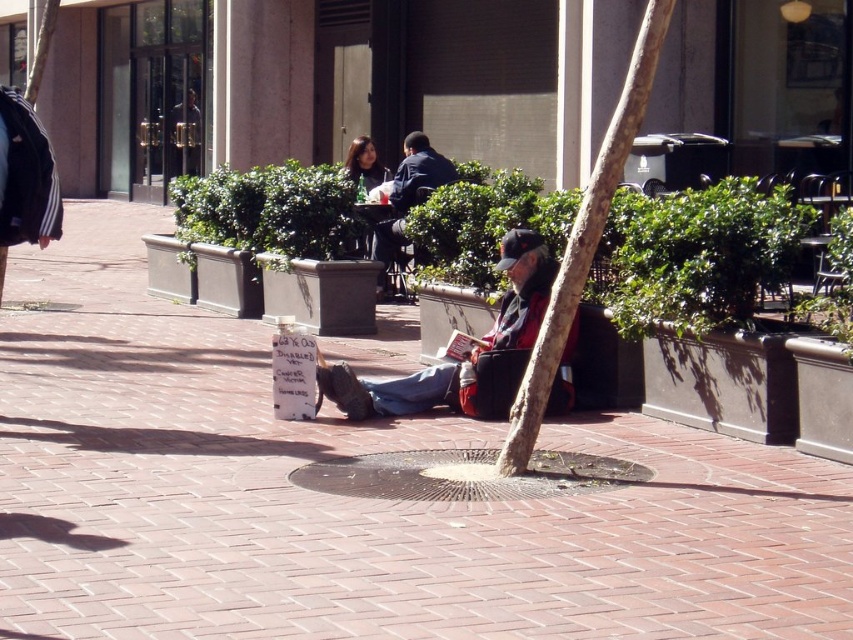
Is metallic gray manhole cover at center below red plaid shirt at center?

Yes.

Between metallic gray manhole cover at center and red plaid shirt at center, which one appears on the left side from the viewer's perspective?

Positioned to the left is red plaid shirt at center.

The image size is (853, 640). Find the location of `metallic gray manhole cover at center`. metallic gray manhole cover at center is located at coordinates (462, 476).

Between brick pavement at center and red plaid shirt at center, which one appears on the left side from the viewer's perspective?

From the viewer's perspective, brick pavement at center appears more on the left side.

Can you confirm if brick pavement at center is positioned below red plaid shirt at center?

Yes, brick pavement at center is below red plaid shirt at center.

Is point (230, 596) behind point (514, 284)?

No, (230, 596) is in front of (514, 284).

Where is `brick pavement at center`? The height and width of the screenshot is (640, 853). brick pavement at center is located at coordinates (352, 499).

Is green leafy tree at center shorter than red plaid shirt at center?

In fact, green leafy tree at center may be taller than red plaid shirt at center.

How distant is green leafy tree at center from red plaid shirt at center?

green leafy tree at center is 1.78 meters from red plaid shirt at center.

Where is `green leafy tree at center`? This screenshot has height=640, width=853. green leafy tree at center is located at coordinates 583,241.